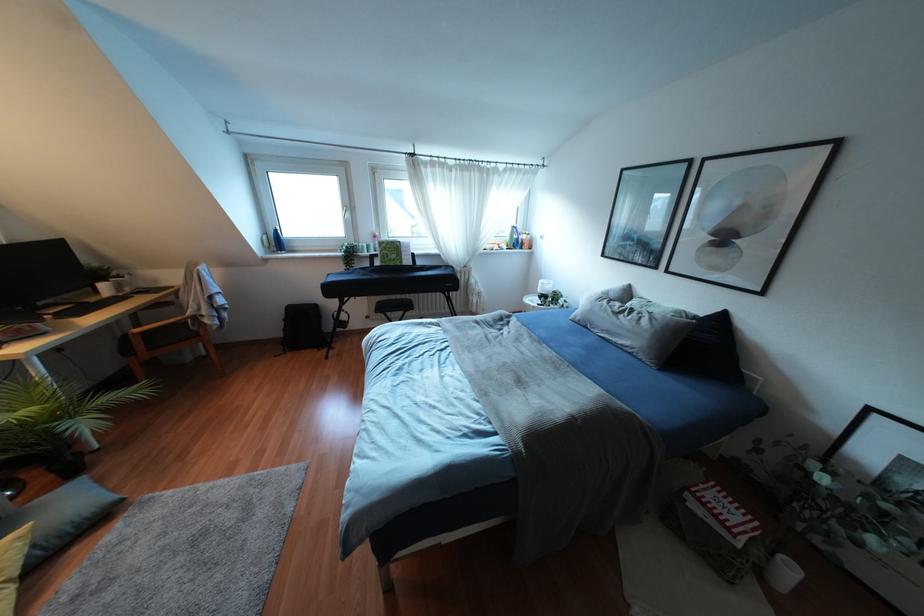
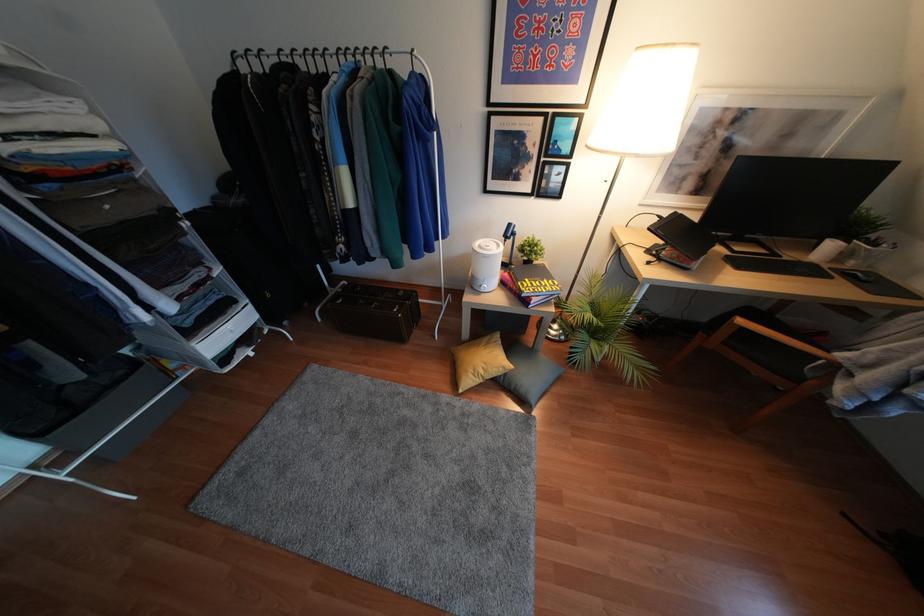
Find the pixel in the second image that matches the point at 103,410 in the first image.

(604, 357)